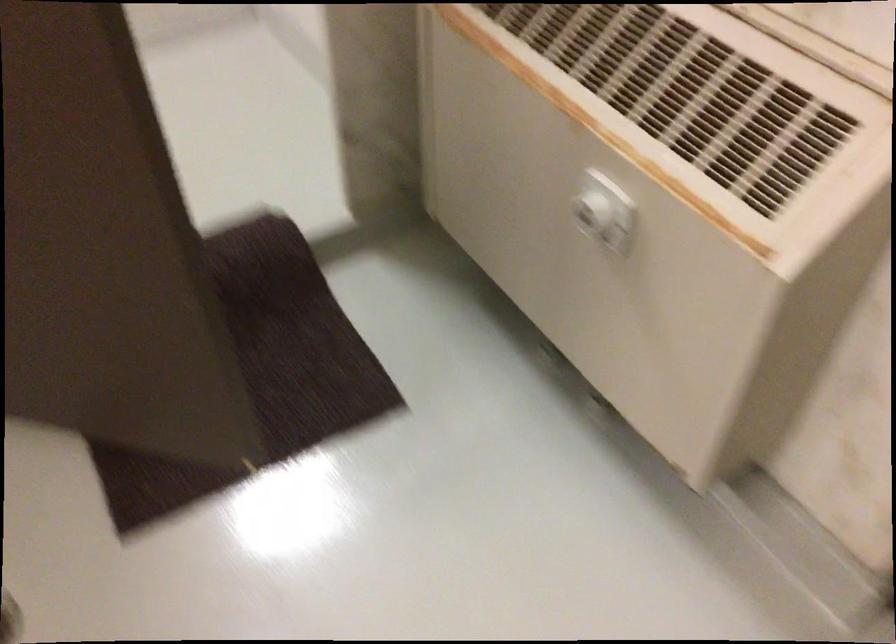
Find the location of a particular element. white control knob is located at coordinates (604, 211).